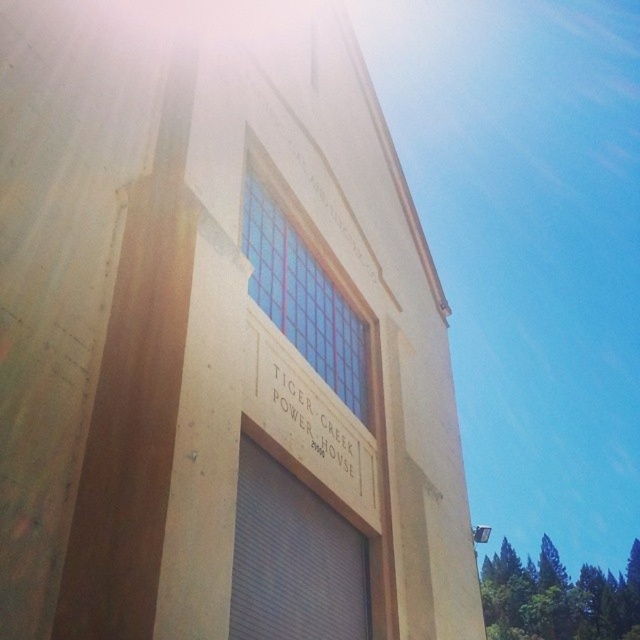
In the scene shown: Is gray metallic garage door at center above white wood tiger creek power house at center?

Incorrect, gray metallic garage door at center is not positioned above white wood tiger creek power house at center.

Is point (316, 624) less distant than point (323, 420)?

Yes, it is in front of point (323, 420).

Locate an element on the screen. This screenshot has width=640, height=640. gray metallic garage door at center is located at coordinates (292, 552).